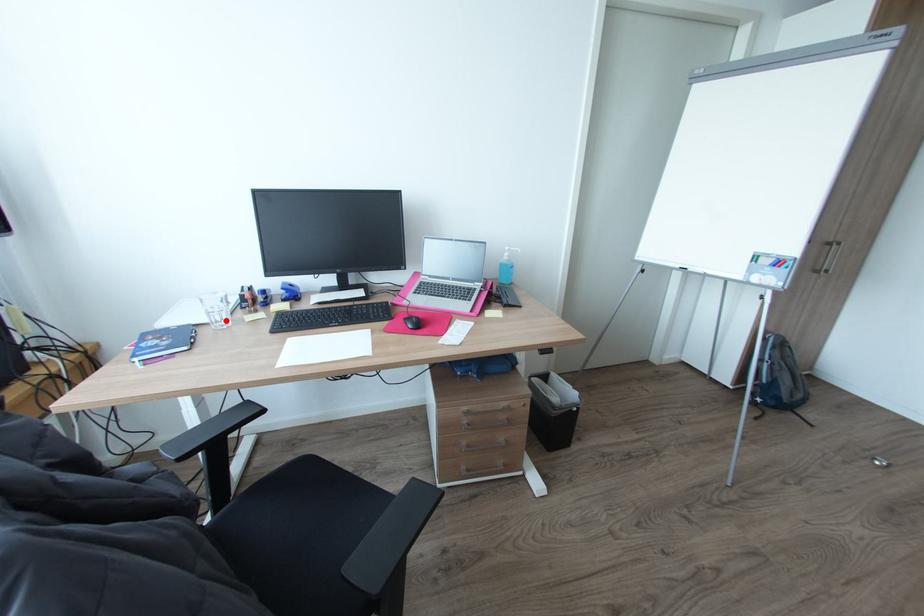
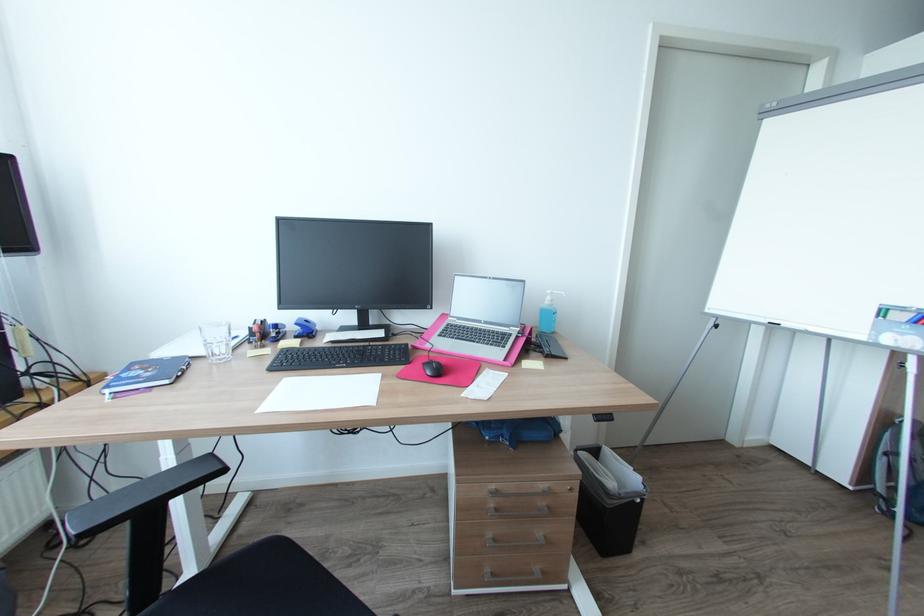
Where in the second image is the point corresponding to the highlighted location from the first image?

(225, 354)